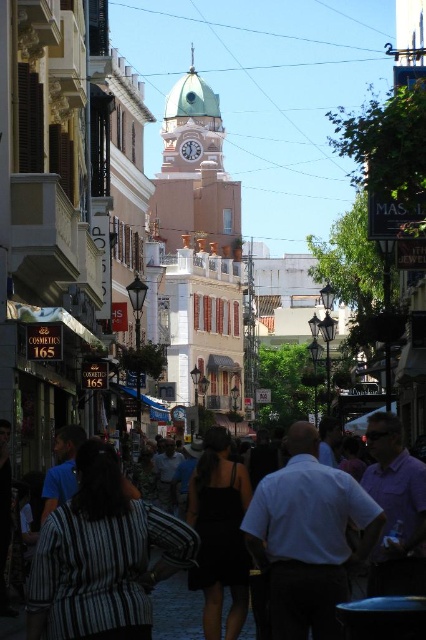
You are a tourist standing in the middle of the cobblestone street and want to take a photo of the light green dome at center while avoiding the black cotton shirt at center in the foreground. Is the dome visible above the shirt?

The light green dome at center is located above the black cotton shirt at center, so yes, the dome is visible above the shirt and can be captured in the photo without obstruction.

You are a tourist standing at the entrance of the street. You want to walk from the entrance to the light green dome at center and then to the black cotton shirt at center. How far will you have to walk in total?

The total distance you will have to walk is 337.03 feet, as the distance between the light green dome at center and the black cotton shirt at center is 337.03 feet.

You are standing on the cobblestone street in the scene and want to walk from point (221, 156) to point (184, 621). Which direction should you face to move towards the latter point?

Since point (221, 156) is further to the viewer than point (184, 621), you should face away from the buildings to move towards point (184, 621).